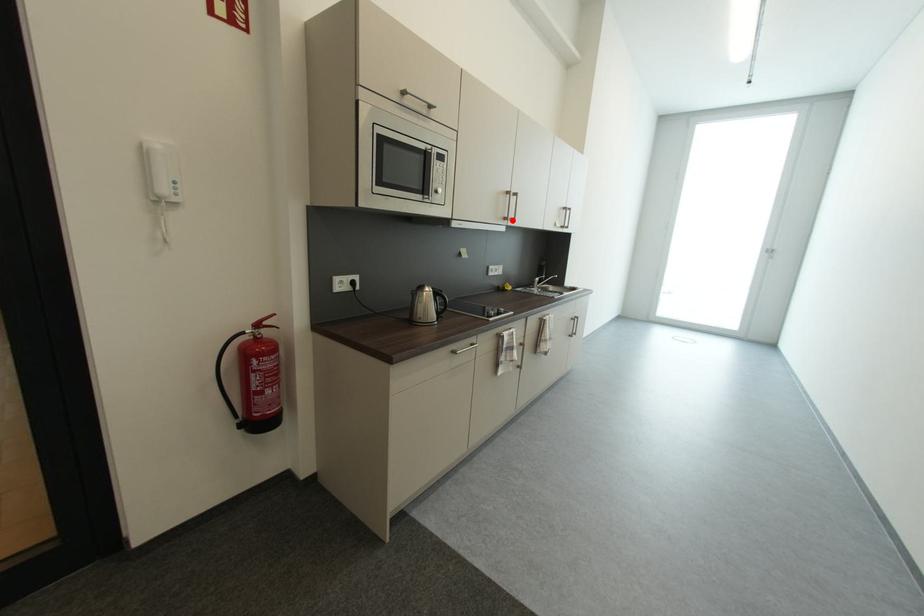
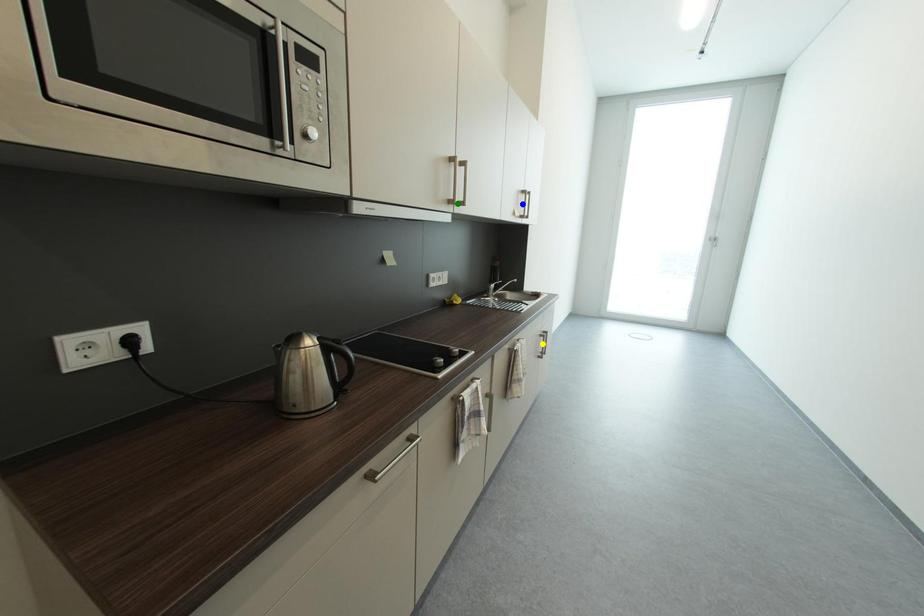
Question: I am providing you with two images of the same scene from different viewpoints. A red point is marked on the first image. You are given multiple points on the second image. In image 2, which mark is for the same physical point as the one in image 1?

Choices:
 (A) yellow point
 (B) green point
 (C) blue point

Answer: (B)